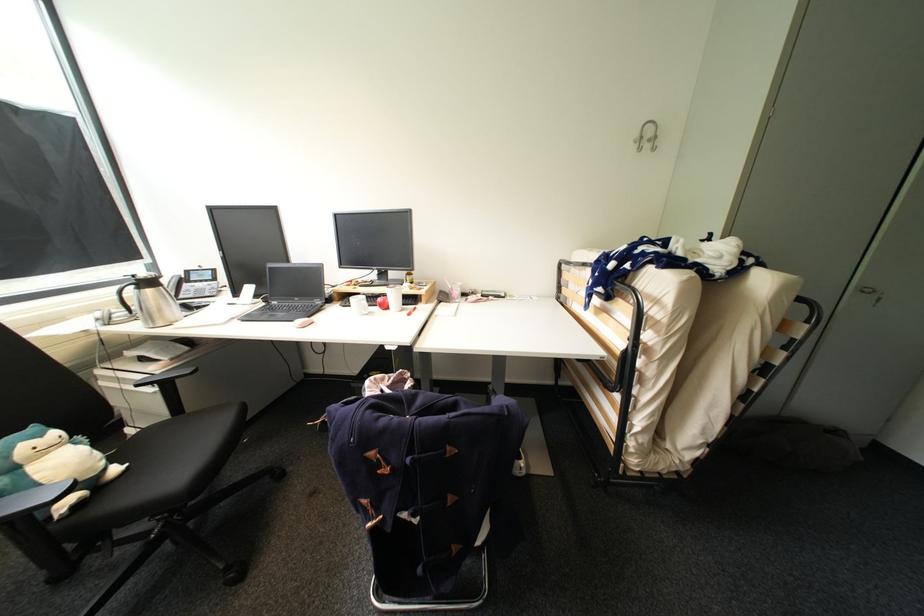
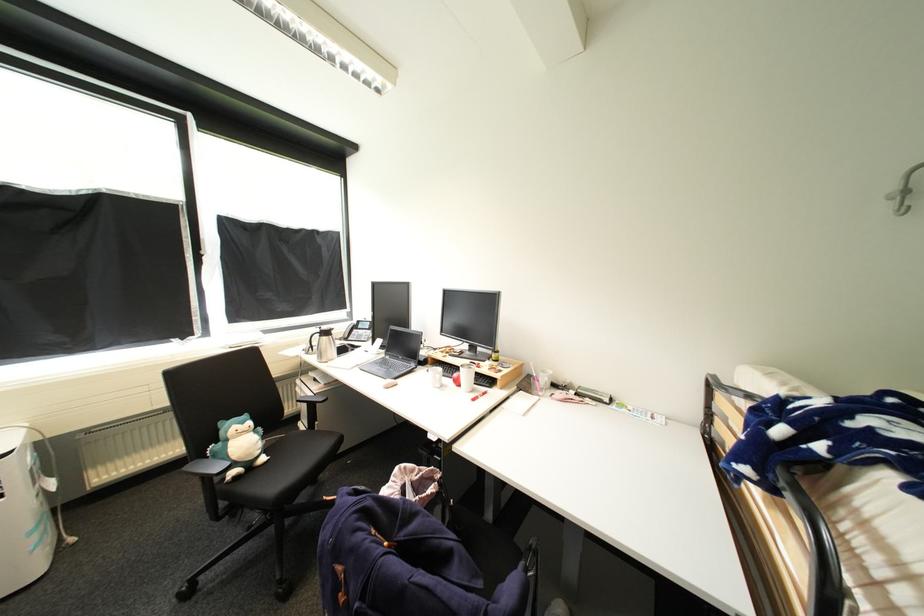
Locate, in the second image, the point that corresponds to (x=385, y=300) in the first image.

(462, 376)